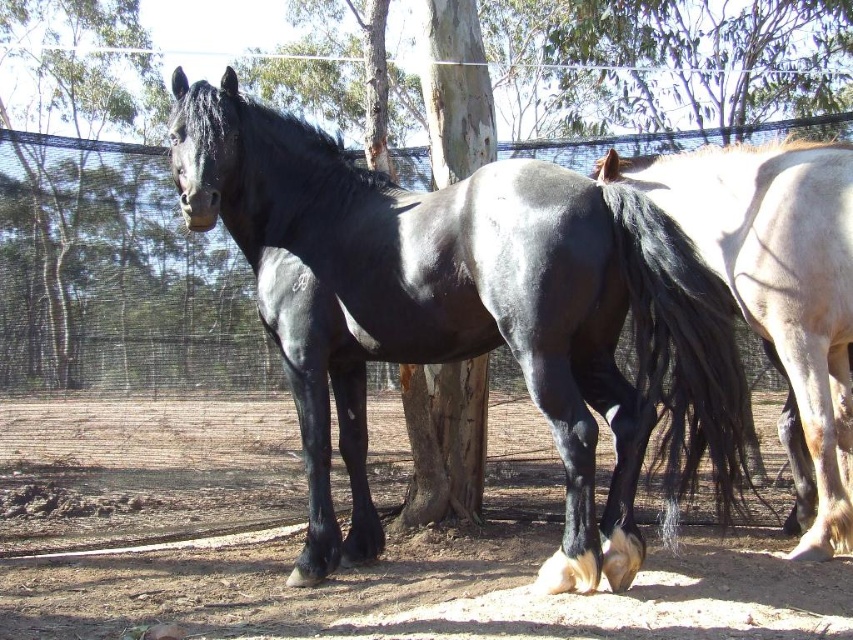
Question: Can you confirm if black glossy horse at center is positioned to the right of dirt field at lower center?

Choices:
 (A) yes
 (B) no

Answer: (B)

Question: Does dirt field at lower center have a larger size compared to black glossy horse at right?

Choices:
 (A) no
 (B) yes

Answer: (A)

Question: Which point is farther from the camera taking this photo?

Choices:
 (A) (515, 440)
 (B) (196, 182)

Answer: (A)

Question: Is smooth bark tree at center below brown textured fence at left?

Choices:
 (A) yes
 (B) no

Answer: (A)

Question: Which point appears farthest from the camera in this image?

Choices:
 (A) (184, 243)
 (B) (177, 70)
 (C) (39, 186)

Answer: (A)

Question: Which point is closer to the camera?

Choices:
 (A) dirt field at lower center
 (B) black glossy horse at right

Answer: (A)